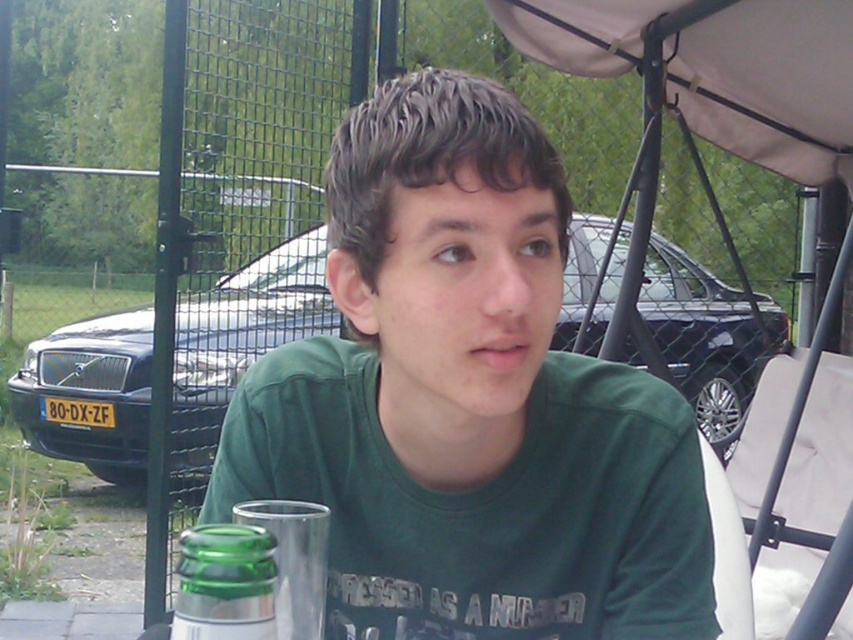
Can you confirm if green matte shirt at center is positioned to the left of green glass bottle at lower left?

Incorrect, green matte shirt at center is not on the left side of green glass bottle at lower left.

Between point (624, 632) and point (248, 538), which one is positioned in front?

Positioned in front is point (248, 538).

Where is `green matte shirt at center`? The image size is (853, 640). green matte shirt at center is located at coordinates pos(468,401).